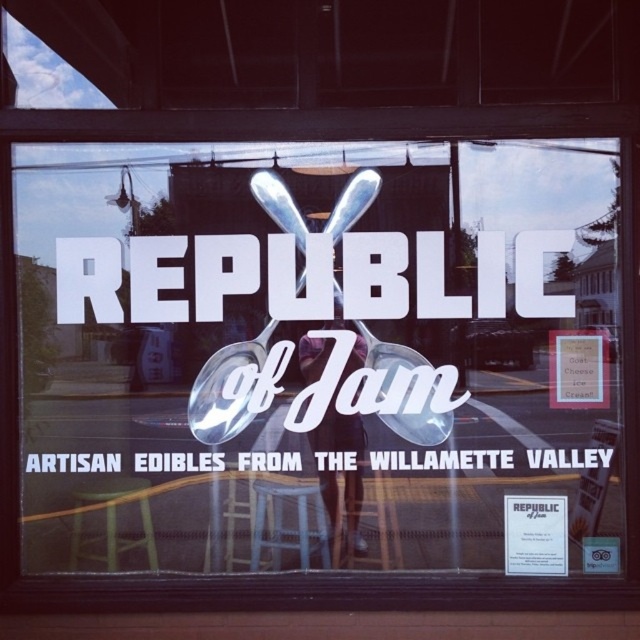
Question: Which of the following is the farthest from the observer?

Choices:
 (A) matte glass sign at center
 (B) matte brown sign at center right
 (C) blue fabric stool at lower center
 (D) yellow plastic stool at lower left

Answer: (C)

Question: Estimate the real-world distances between objects in this image. Which object is closer to the matte brown sign at center right?

Choices:
 (A) blue fabric stool at lower center
 (B) yellow plastic stool at lower left

Answer: (A)

Question: Is yellow plastic stool at lower left further to the viewer compared to matte brown sign at center right?

Choices:
 (A) yes
 (B) no

Answer: (A)

Question: Where is yellow plastic stool at lower left located in relation to matte brown sign at center right in the image?

Choices:
 (A) right
 (B) left

Answer: (B)

Question: Which point is closer to the camera?

Choices:
 (A) (250, 566)
 (B) (134, 300)
 (C) (552, 396)

Answer: (B)

Question: Is yellow plastic stool at lower left further to camera compared to matte brown sign at center right?

Choices:
 (A) no
 (B) yes

Answer: (B)